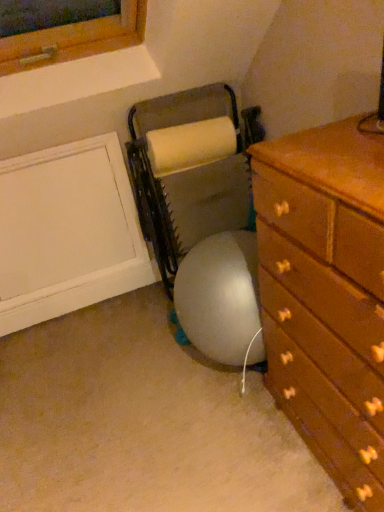
Question: Considering the relative positions of gray fabric bean bag chair at center and wooden chest of drawers at lower right in the image provided, is gray fabric bean bag chair at center to the right of wooden chest of drawers at lower right from the viewer's perspective?

Choices:
 (A) yes
 (B) no

Answer: (B)

Question: Can you confirm if gray fabric bean bag chair at center is wider than wooden chest of drawers at lower right?

Choices:
 (A) yes
 (B) no

Answer: (B)

Question: Is gray fabric bean bag chair at center at the left side of wooden chest of drawers at lower right?

Choices:
 (A) yes
 (B) no

Answer: (A)

Question: Is gray fabric bean bag chair at center shorter than wooden chest of drawers at lower right?

Choices:
 (A) no
 (B) yes

Answer: (B)

Question: From a real-world perspective, is gray fabric bean bag chair at center positioned over wooden chest of drawers at lower right based on gravity?

Choices:
 (A) no
 (B) yes

Answer: (B)

Question: Is gray fabric bean bag chair at center positioned in front of wooden chest of drawers at lower right?

Choices:
 (A) yes
 (B) no

Answer: (B)

Question: Is gray fabric bean bag chair at center at the back of wooden chest of drawers at lower right?

Choices:
 (A) no
 (B) yes

Answer: (A)

Question: Is wooden chest of drawers at lower right next to gray fabric bean bag chair at center and touching it?

Choices:
 (A) no
 (B) yes

Answer: (A)

Question: Is wooden chest of drawers at lower right taller than gray fabric bean bag chair at center?

Choices:
 (A) yes
 (B) no

Answer: (A)

Question: Is wooden chest of drawers at lower right completely or partially outside of gray fabric bean bag chair at center?

Choices:
 (A) no
 (B) yes

Answer: (B)

Question: Could you tell me if wooden chest of drawers at lower right is facing gray fabric bean bag chair at center?

Choices:
 (A) yes
 (B) no

Answer: (B)

Question: Can you confirm if wooden chest of drawers at lower right is wider than gray fabric bean bag chair at center?

Choices:
 (A) no
 (B) yes

Answer: (B)

Question: From a real-world perspective, is gray fabric bean bag chair at center above or below wooden chest of drawers at lower right?

Choices:
 (A) below
 (B) above

Answer: (B)